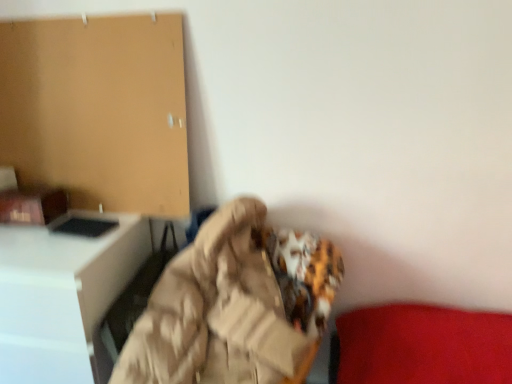
Question: Can you confirm if beige fabric bean bag chair at center is shorter than white glossy desk at left?

Choices:
 (A) yes
 (B) no

Answer: (A)

Question: Considering the relative positions of beige fabric bean bag chair at center and white glossy desk at left in the image provided, is beige fabric bean bag chair at center in front of white glossy desk at left?

Choices:
 (A) yes
 (B) no

Answer: (A)

Question: From a real-world perspective, is beige fabric bean bag chair at center beneath white glossy desk at left?

Choices:
 (A) yes
 (B) no

Answer: (B)

Question: Is beige fabric bean bag chair at center positioned beyond the bounds of white glossy desk at left?

Choices:
 (A) no
 (B) yes

Answer: (B)

Question: Can you confirm if beige fabric bean bag chair at center is taller than white glossy desk at left?

Choices:
 (A) no
 (B) yes

Answer: (A)

Question: Considering the relative sizes of beige fabric bean bag chair at center and white glossy desk at left in the image provided, is beige fabric bean bag chair at center bigger than white glossy desk at left?

Choices:
 (A) yes
 (B) no

Answer: (B)

Question: Is white glossy desk at left aimed at beige fabric bean bag chair at center?

Choices:
 (A) yes
 (B) no

Answer: (B)

Question: Is white glossy desk at left positioned with its back to beige fabric bean bag chair at center?

Choices:
 (A) yes
 (B) no

Answer: (B)

Question: From a real-world perspective, is white glossy desk at left located higher than beige fabric bean bag chair at center?

Choices:
 (A) no
 (B) yes

Answer: (A)

Question: Is white glossy desk at left further to camera compared to beige fabric bean bag chair at center?

Choices:
 (A) no
 (B) yes

Answer: (B)

Question: Is white glossy desk at left positioned beyond the bounds of beige fabric bean bag chair at center?

Choices:
 (A) yes
 (B) no

Answer: (A)

Question: From the image's perspective, is white glossy desk at left over beige fabric bean bag chair at center?

Choices:
 (A) no
 (B) yes

Answer: (A)

Question: Considering the positions of white glossy desk at left and beige fabric bean bag chair at center in the image, is white glossy desk at left wider or thinner than beige fabric bean bag chair at center?

Choices:
 (A) thin
 (B) wide

Answer: (A)